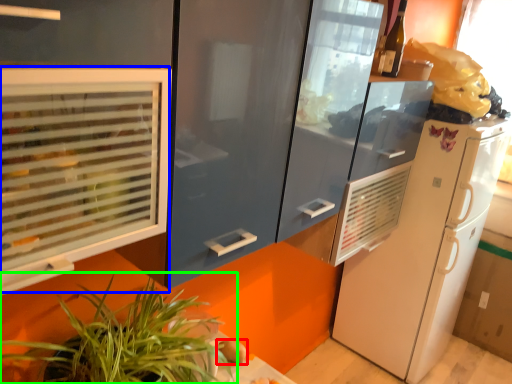
Question: Which object is positioned farthest from food (highlighted by a red box)? Select from window (highlighted by a blue box) and houseplant (highlighted by a green box).

Choices:
 (A) window
 (B) houseplant

Answer: (A)